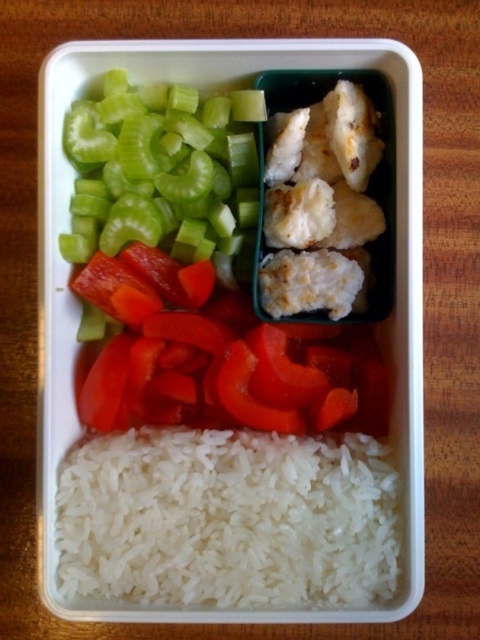
Does point (190, 508) come in front of point (156, 241)?

Yes, point (190, 508) is closer to viewer.

Identify the location of white matte rice at bottom. The image size is (480, 640). (228, 518).

Image resolution: width=480 pixels, height=640 pixels. I want to click on white matte rice at bottom, so click(228, 518).